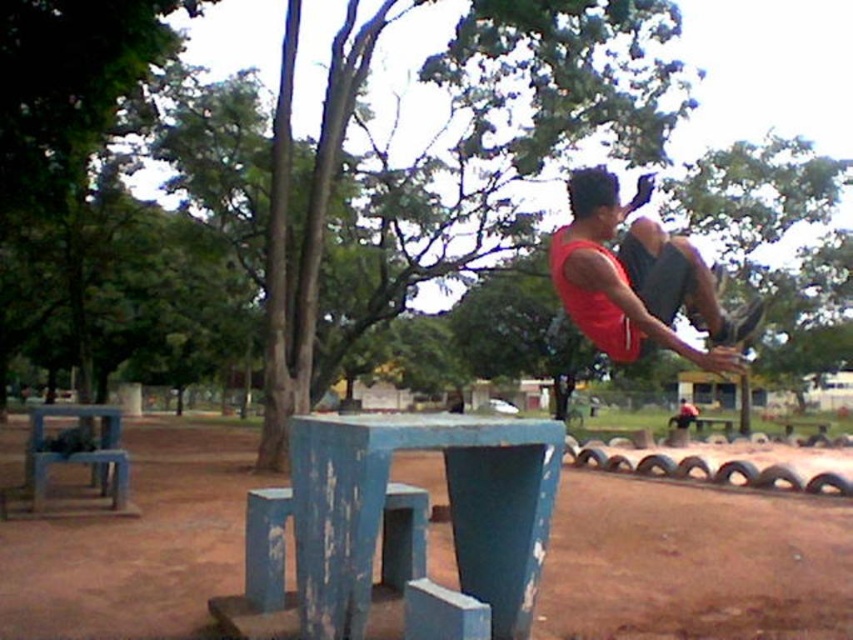
Question: Is blue painted concrete at center above matte red tank top at upper right?

Choices:
 (A) yes
 (B) no

Answer: (B)

Question: Which point is farther to the camera?

Choices:
 (A) (490, 550)
 (B) (39, 588)
 (C) (589, 221)

Answer: (B)

Question: Can you confirm if blue painted concrete at center is thinner than matte red tank top at upper right?

Choices:
 (A) no
 (B) yes

Answer: (A)

Question: Which point is farther from the camera taking this photo?

Choices:
 (A) (635, 285)
 (B) (325, 516)

Answer: (A)

Question: Estimate the real-world distances between objects in this image. Which object is closer to the blue painted concrete at center?

Choices:
 (A) blue painted wood table at center
 (B) matte red tank top at upper right

Answer: (A)

Question: Can you confirm if blue painted concrete at center is bigger than blue painted wood table at center?

Choices:
 (A) yes
 (B) no

Answer: (A)